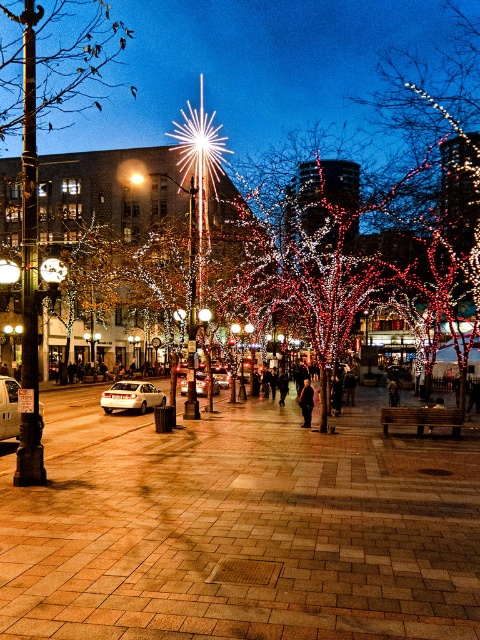
Question: Among these points, which one is nearest to the camera?

Choices:
 (A) (302, 406)
 (B) (119, 582)

Answer: (B)

Question: Is brick pavement at center bigger than dark gray coat at center?

Choices:
 (A) yes
 (B) no

Answer: (A)

Question: Is brick pavement at center closer to camera compared to dark gray coat at center?

Choices:
 (A) yes
 (B) no

Answer: (A)

Question: Is brick pavement at center to the left of dark gray coat at center from the viewer's perspective?

Choices:
 (A) yes
 (B) no

Answer: (A)